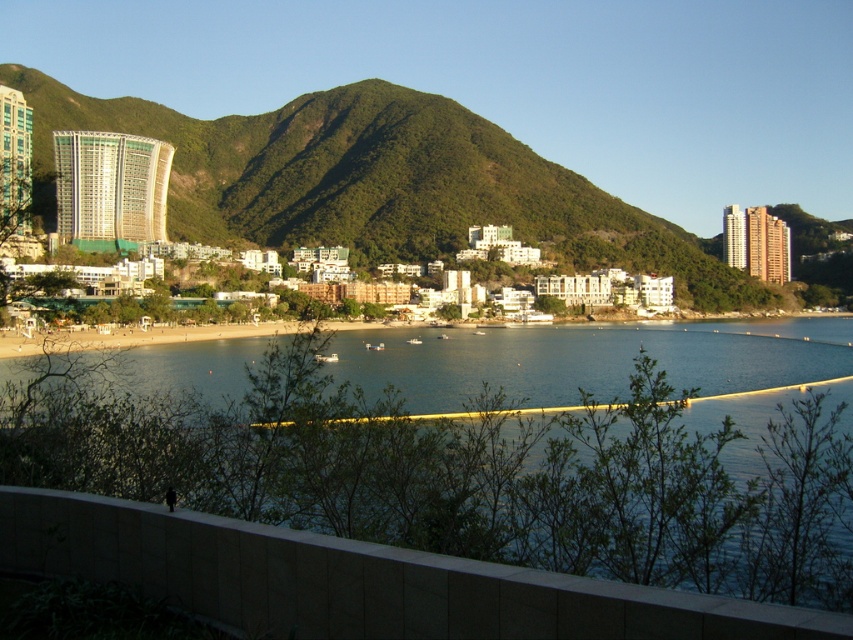
Question: Does clear blue water at center appear over green textured mountain at center?

Choices:
 (A) yes
 (B) no

Answer: (B)

Question: Does clear blue water at center have a lesser width compared to green textured mountain at center?

Choices:
 (A) yes
 (B) no

Answer: (A)

Question: Which of the following is the farthest from the observer?

Choices:
 (A) (699, 273)
 (B) (625, 435)

Answer: (A)

Question: Which point is farther to the camera?

Choices:
 (A) (569, 209)
 (B) (463, 440)

Answer: (A)

Question: Does clear blue water at center lie behind green textured mountain at center?

Choices:
 (A) yes
 (B) no

Answer: (B)

Question: Which of the following is the closest to the observer?

Choices:
 (A) (364, 253)
 (B) (77, 484)

Answer: (B)